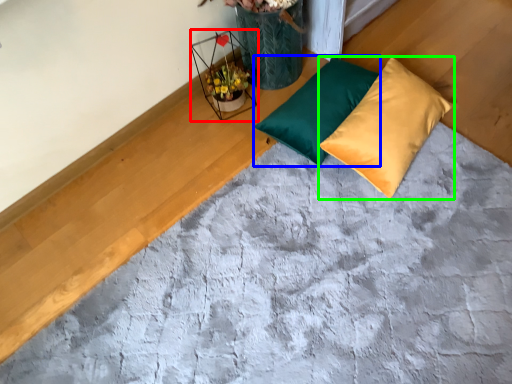
Question: Considering the real-world distances, which object is farthest from flower basket (highlighted by a red box)? pillow (highlighted by a blue box) or pillow (highlighted by a green box)?

Choices:
 (A) pillow
 (B) pillow

Answer: (B)